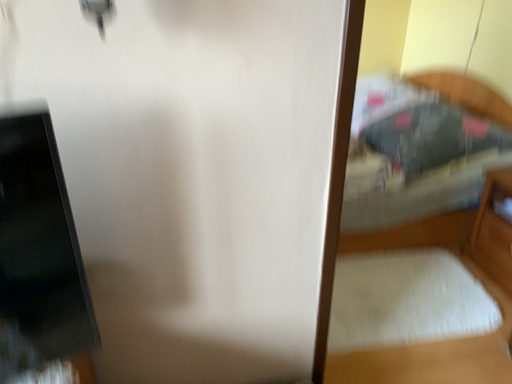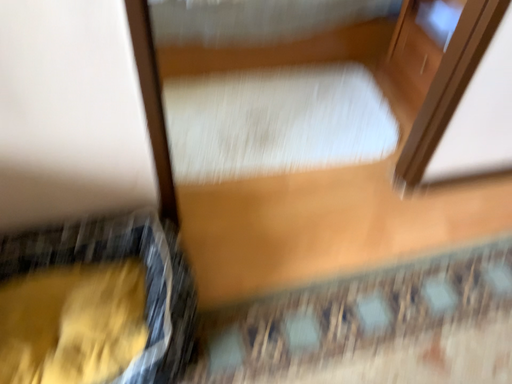
Question: Which way did the camera rotate in the video?

Choices:
 (A) rotated downward
 (B) rotated upward

Answer: (A)